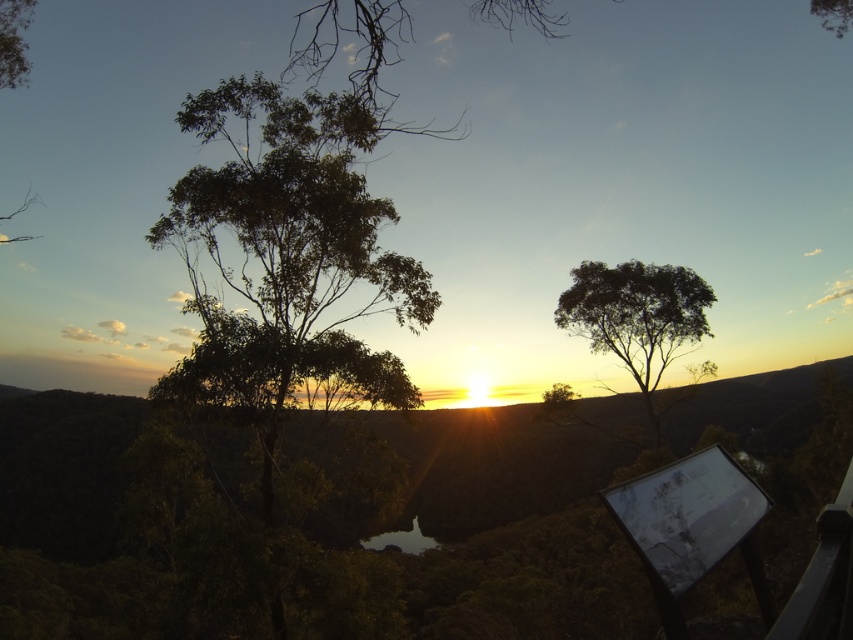
You are standing at the point marked by coordinates point (286, 259). Looking towards the sunset, you see a green leafy tree at left and another tree to your right. Which tree is closer to the sunset direction?

The green leafy tree at left is closer to the sunset direction because it is positioned to the left of the point (286, 259), which is the direction the sunset is coming from.

You are an artist trying to sketch the sunset scene. You want to place the green leafy tree at left accurately in your drawing. According to the coordinates provided, where should you position it on your canvas?

The green leafy tree at left should be positioned at the coordinates point (286, 259) on the canvas.